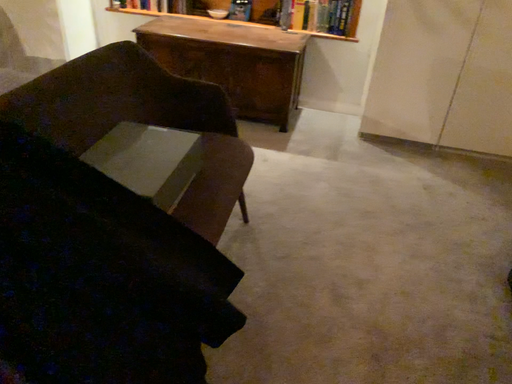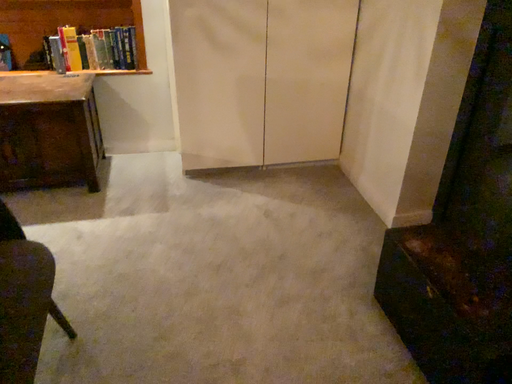
Question: How did the camera likely rotate when shooting the video?

Choices:
 (A) rotated right
 (B) rotated left

Answer: (A)